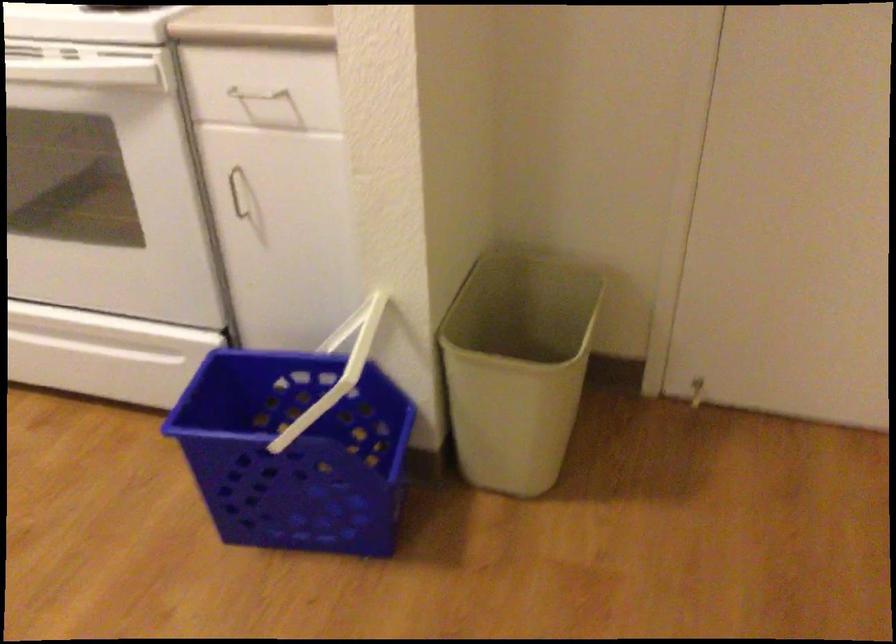
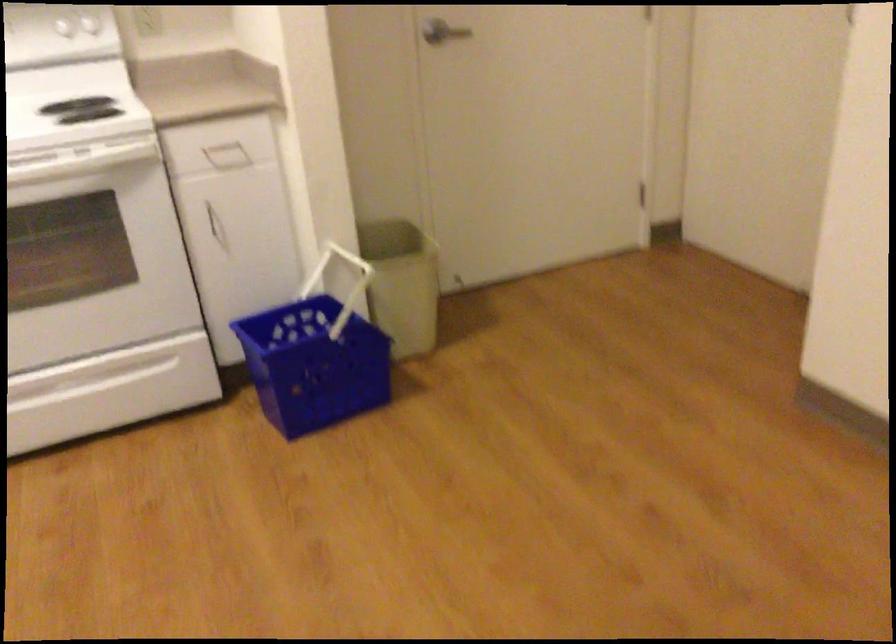
Find the pixel in the second image that matches point (478, 395) in the first image.

(401, 283)